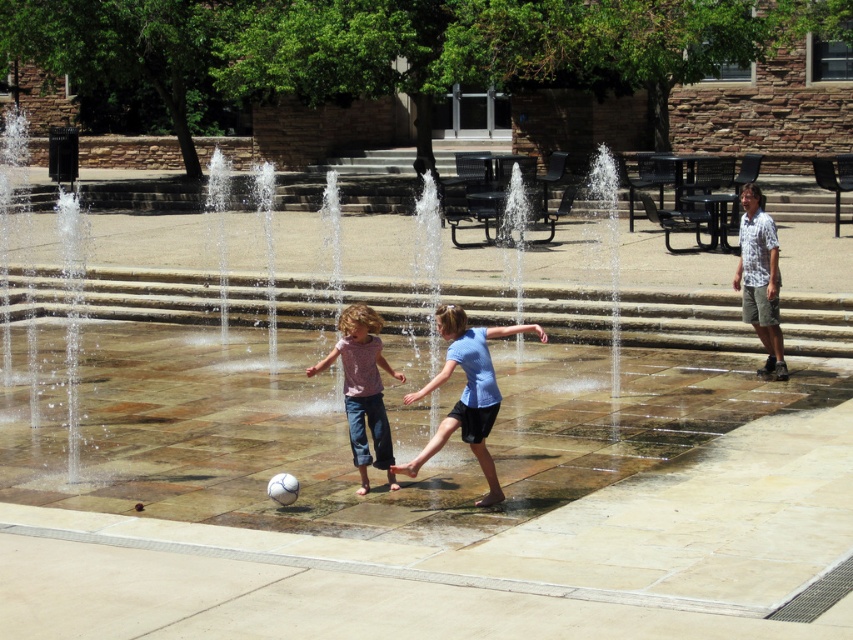
You are a photographer standing at the edge of the square. You want to capture a photo of the blue matte shirt at center and denim pants at center so that both are in focus. Given that your camera can only sharply focus on objects within a 20 inch range, will you be able to achieve this?

The blue matte shirt at center is 22.89 inches away from denim pants at center. Since the camera can only focus within a 20 inch range, the distance between them exceeds the focus range. Therefore, it will be difficult to have both in sharp focus.

You are a photographer trying to capture a candid shot of the blue matte shirt at center and denim pants at center. Since you want to ensure both are clearly visible, which object should you focus on first considering their sizes?

The blue matte shirt at center has a larger size compared to denim pants at center, so you should focus on the blue matte shirt at center first to ensure clarity.